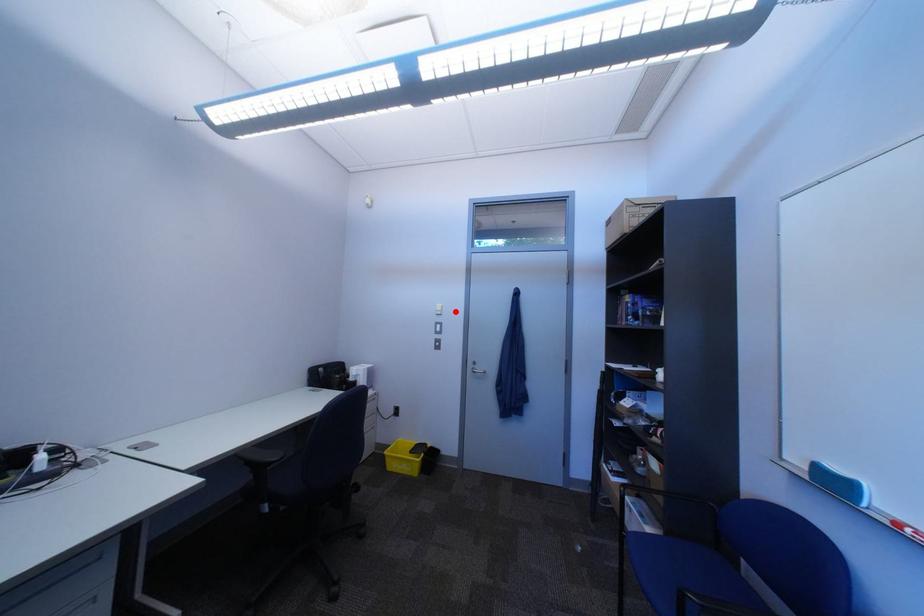
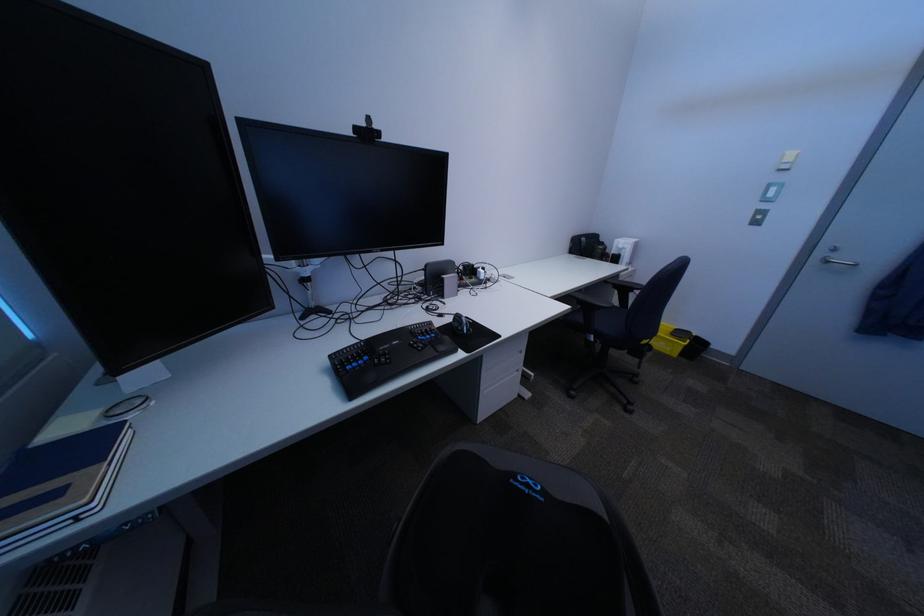
In the second image, find the point that corresponds to the highlighted location in the first image.

(807, 163)